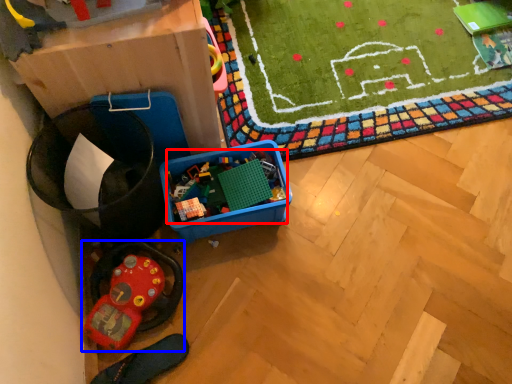
Question: Which object is further to the camera taking this photo, toy (highlighted by a red box) or toy (highlighted by a blue box)?

Choices:
 (A) toy
 (B) toy

Answer: (A)